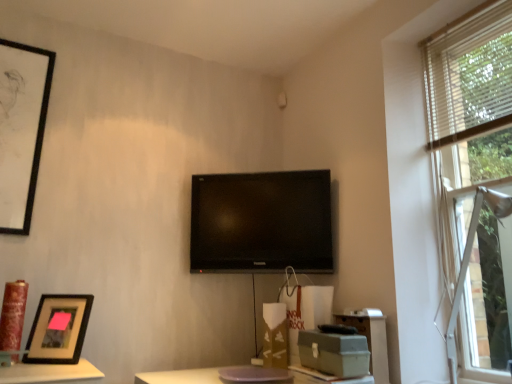
Question: Does matte gray file cabinet at lower right appear on the left side of brown cardboard box at center, which is counted as the 2th cardboard box, starting from the front?

Choices:
 (A) no
 (B) yes

Answer: (A)

Question: Is matte gray file cabinet at lower right shorter than brown cardboard box at center, which is the second cardboard box in right-to-left order?

Choices:
 (A) yes
 (B) no

Answer: (A)

Question: Could you tell me if matte gray file cabinet at lower right is turned towards brown cardboard box at center, positioned as the 1th cardboard box in back-to-front order?

Choices:
 (A) no
 (B) yes

Answer: (A)

Question: Is matte gray file cabinet at lower right not close to brown cardboard box at center, arranged as the 1th cardboard box when viewed from the left?

Choices:
 (A) yes
 (B) no

Answer: (B)

Question: Does matte gray file cabinet at lower right have a greater width compared to brown cardboard box at center, arranged as the 1th cardboard box when viewed from the left?

Choices:
 (A) no
 (B) yes

Answer: (A)

Question: Considering the relative positions of matte gray file cabinet at lower right and brown cardboard box at center, arranged as the 1th cardboard box when viewed from the left, in the image provided, is matte gray file cabinet at lower right to the right of brown cardboard box at center, arranged as the 1th cardboard box when viewed from the left, from the viewer's perspective?

Choices:
 (A) no
 (B) yes

Answer: (B)

Question: From a real-world perspective, is wooden frame at right on matte gray file cabinet at lower right?

Choices:
 (A) no
 (B) yes

Answer: (B)

Question: Is wooden frame at right to the left of matte gray file cabinet at lower right from the viewer's perspective?

Choices:
 (A) yes
 (B) no

Answer: (B)

Question: Is wooden frame at right looking in the opposite direction of matte gray file cabinet at lower right?

Choices:
 (A) no
 (B) yes

Answer: (A)

Question: Is wooden frame at right not near matte gray file cabinet at lower right?

Choices:
 (A) no
 (B) yes

Answer: (A)

Question: Is matte gray file cabinet at lower right inside wooden frame at right?

Choices:
 (A) no
 (B) yes

Answer: (A)

Question: Can you confirm if wooden frame at right is smaller than matte gray file cabinet at lower right?

Choices:
 (A) yes
 (B) no

Answer: (B)

Question: From the image's perspective, is black matte picture frame at lower left, arranged as the 2th picture frame when viewed from the top, under matte gray file cabinet at lower right?

Choices:
 (A) no
 (B) yes

Answer: (A)